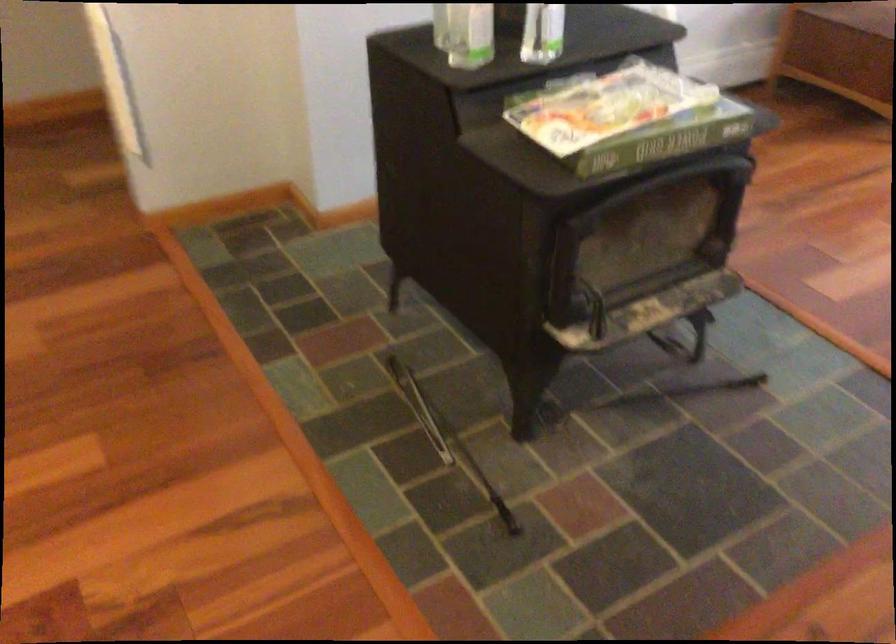
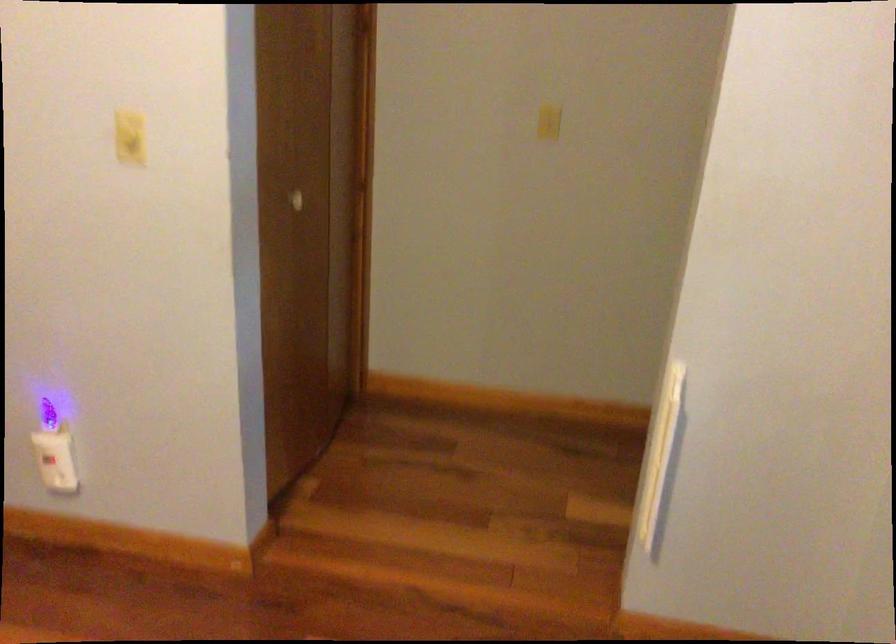
Question: The camera is either moving clockwise (left) or counter-clockwise (right) around the object. The first image is from the beginning of the video and the second image is from the end. Is the camera moving left or right when shooting the video?

Choices:
 (A) Left
 (B) Right

Answer: (B)